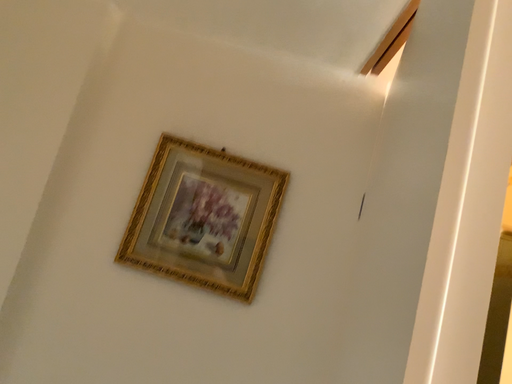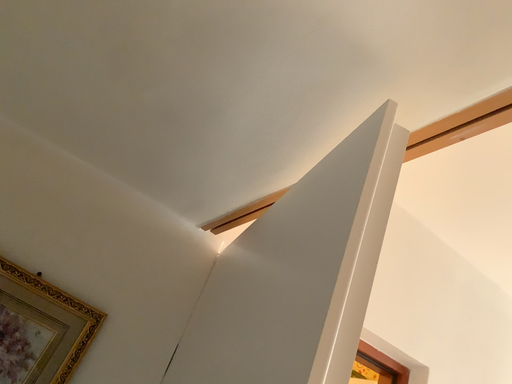
Question: How did the camera likely rotate when shooting the video?

Choices:
 (A) rotated upward
 (B) rotated downward

Answer: (A)